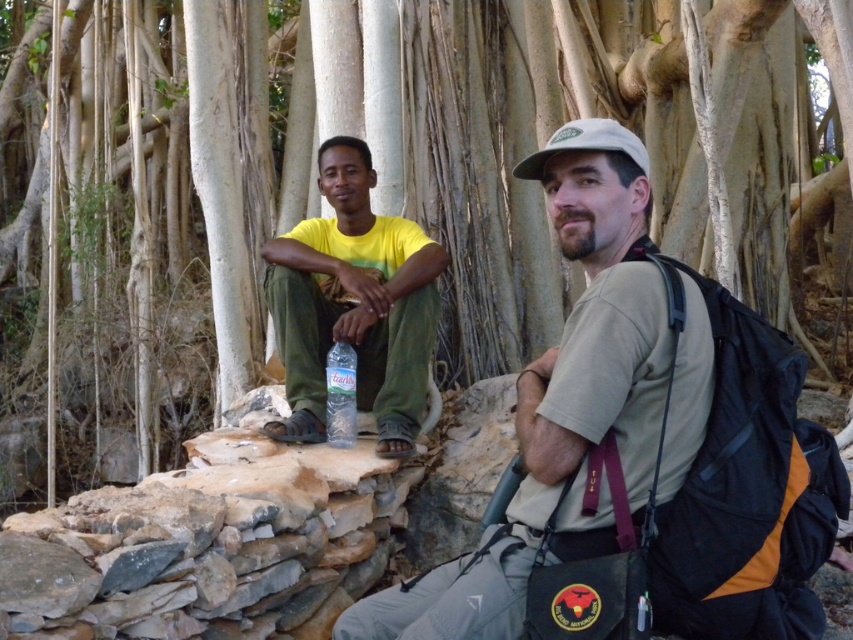
Question: Is matte khaki t-shirt at center to the left of clear plastic bottle at center from the viewer's perspective?

Choices:
 (A) yes
 (B) no

Answer: (B)

Question: Estimate the real-world distances between objects in this image. Which object is closer to the clear plastic bottle at center?

Choices:
 (A) matte khaki t-shirt at center
 (B) yellow t-shirt at center

Answer: (B)

Question: Among these points, which one is nearest to the camera?

Choices:
 (A) (345, 353)
 (B) (698, 388)
 (C) (350, 237)

Answer: (B)

Question: Which object is positioned closest to the matte khaki t-shirt at center?

Choices:
 (A) clear plastic bottle at center
 (B) yellow t-shirt at center

Answer: (A)

Question: Is yellow t-shirt at center positioned in front of clear plastic bottle at center?

Choices:
 (A) yes
 (B) no

Answer: (A)

Question: Does yellow t-shirt at center come behind clear plastic bottle at center?

Choices:
 (A) no
 (B) yes

Answer: (A)